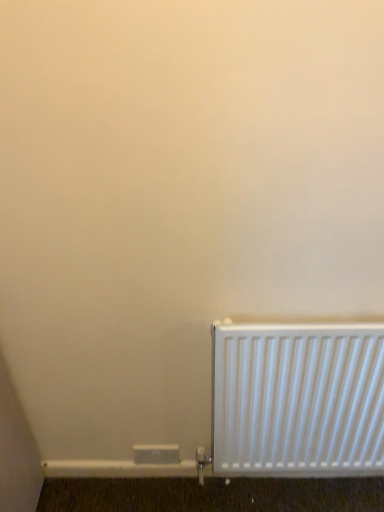
Where is `white matte radiator at lower right`? white matte radiator at lower right is located at coordinates (298, 399).

The image size is (384, 512). Describe the element at coordinates (298, 399) in the screenshot. I see `white matte radiator at lower right` at that location.

Locate an element on the screen. white matte radiator at lower right is located at coordinates (298, 399).